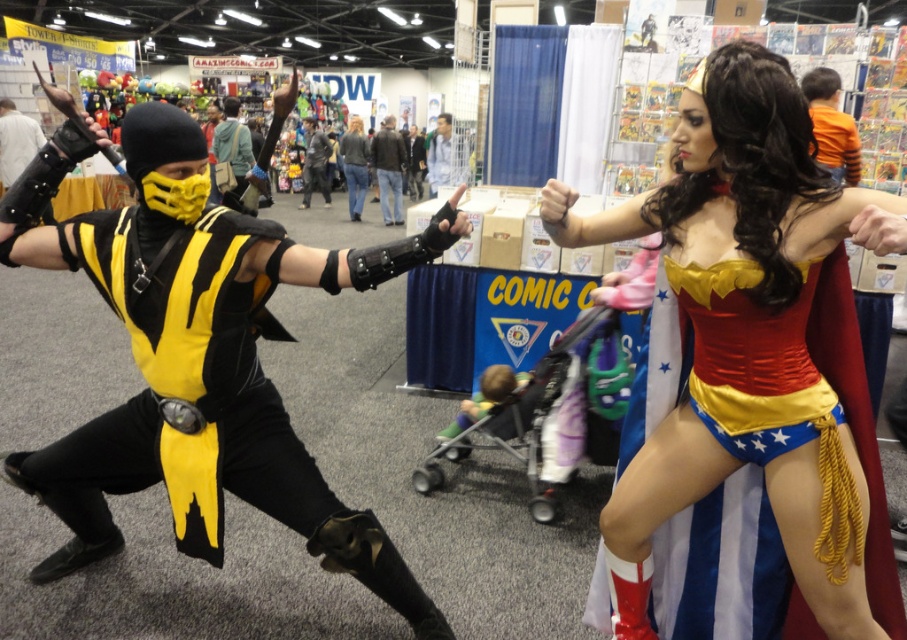
Between point (671, 134) and point (402, 145), which one is positioned behind?

Positioned behind is point (402, 145).

Between shiny red fabric cape at right and dark brown leather jacket at center, which one appears on the right side from the viewer's perspective?

From the viewer's perspective, shiny red fabric cape at right appears more on the right side.

Is point (690, 172) less distant than point (379, 204)?

Yes, point (690, 172) is closer to viewer.

Image resolution: width=907 pixels, height=640 pixels. In order to click on shiny red fabric cape at right in this screenshot , I will do `click(749, 374)`.

Is shiny red fabric cape at right shorter than dark gray fabric jacket at center?

No.

Can you confirm if shiny red fabric cape at right is positioned above dark gray fabric jacket at center?

No, shiny red fabric cape at right is not above dark gray fabric jacket at center.

Is point (774, 214) farther from viewer compared to point (317, 172)?

No.

Find the location of `shiny red fabric cape at right`. shiny red fabric cape at right is located at coordinates (749, 374).

Can you confirm if matte black vest at left is smaller than orange cotton shirt at upper right?

Actually, matte black vest at left might be larger than orange cotton shirt at upper right.

Does matte black vest at left appear on the left side of orange cotton shirt at upper right?

Indeed, matte black vest at left is positioned on the left side of orange cotton shirt at upper right.

What do you see at coordinates (198, 360) in the screenshot? The width and height of the screenshot is (907, 640). I see `matte black vest at left` at bounding box center [198, 360].

This screenshot has width=907, height=640. In order to click on matte black vest at left in this screenshot , I will do `click(198, 360)`.